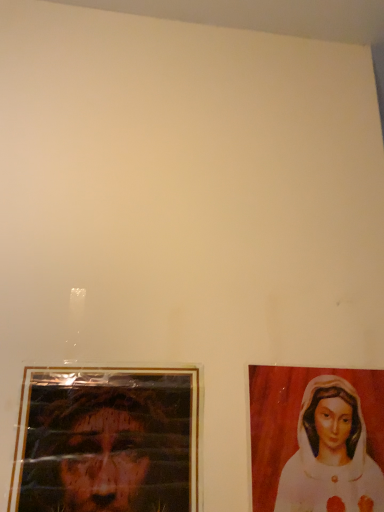
Question: In terms of size, does gold-framed photo at lower left appear bigger or smaller than matte white painting of woman at right?

Choices:
 (A) big
 (B) small

Answer: (A)

Question: Is gold-framed photo at lower left taller or shorter than matte white painting of woman at right?

Choices:
 (A) short
 (B) tall

Answer: (B)

Question: Considering the positions of point (147, 403) and point (312, 455), is point (147, 403) closer or farther from the camera than point (312, 455)?

Choices:
 (A) closer
 (B) farther

Answer: (A)

Question: Is point (362, 417) positioned closer to the camera than point (188, 385)?

Choices:
 (A) closer
 (B) farther

Answer: (B)

Question: Is matte white painting of woman at right taller or shorter than gold-framed photo at lower left?

Choices:
 (A) short
 (B) tall

Answer: (A)

Question: Is matte white painting of woman at right spatially inside gold-framed photo at lower left, or outside of it?

Choices:
 (A) outside
 (B) inside

Answer: (A)

Question: Looking at their shapes, would you say matte white painting of woman at right is wider or thinner than gold-framed photo at lower left?

Choices:
 (A) thin
 (B) wide

Answer: (A)